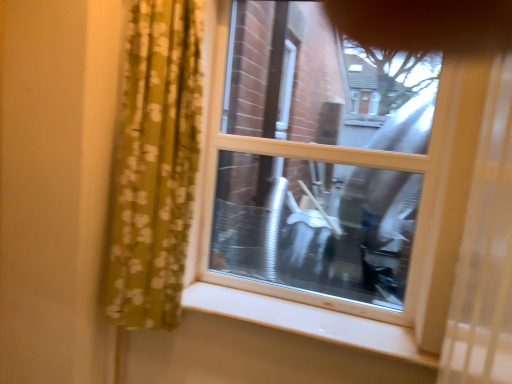
Question: Should I look upward or downward to see white smooth window sill at lower center?

Choices:
 (A) up
 (B) down

Answer: (B)

Question: From a real-world perspective, is white smooth window sill at lower center below transparent glass window at center?

Choices:
 (A) no
 (B) yes

Answer: (B)

Question: Is white smooth window sill at lower center in front of transparent glass window at center?

Choices:
 (A) no
 (B) yes

Answer: (B)

Question: Is white smooth window sill at lower center outside transparent glass window at center?

Choices:
 (A) yes
 (B) no

Answer: (A)

Question: Considering the relative sizes of white smooth window sill at lower center and transparent glass window at center in the image provided, is white smooth window sill at lower center taller than transparent glass window at center?

Choices:
 (A) yes
 (B) no

Answer: (B)

Question: Is white smooth window sill at lower center touching transparent glass window at center?

Choices:
 (A) no
 (B) yes

Answer: (A)

Question: From a real-world perspective, is white smooth window sill at lower center over transparent glass window at center?

Choices:
 (A) no
 (B) yes

Answer: (A)

Question: Considering the relative sizes of transparent glass window at center and white smooth window sill at lower center in the image provided, is transparent glass window at center taller than white smooth window sill at lower center?

Choices:
 (A) yes
 (B) no

Answer: (A)

Question: Are transparent glass window at center and white smooth window sill at lower center located far from each other?

Choices:
 (A) yes
 (B) no

Answer: (B)

Question: Does transparent glass window at center have a lesser height compared to white smooth window sill at lower center?

Choices:
 (A) no
 (B) yes

Answer: (A)

Question: Considering the relative sizes of transparent glass window at center and white smooth window sill at lower center in the image provided, is transparent glass window at center wider than white smooth window sill at lower center?

Choices:
 (A) no
 (B) yes

Answer: (A)

Question: Is transparent glass window at center not within white smooth window sill at lower center?

Choices:
 (A) yes
 (B) no

Answer: (A)

Question: Can you confirm if transparent glass window at center is smaller than white smooth window sill at lower center?

Choices:
 (A) no
 (B) yes

Answer: (A)

Question: Does point (449, 160) appear closer or farther from the camera than point (386, 354)?

Choices:
 (A) closer
 (B) farther

Answer: (A)